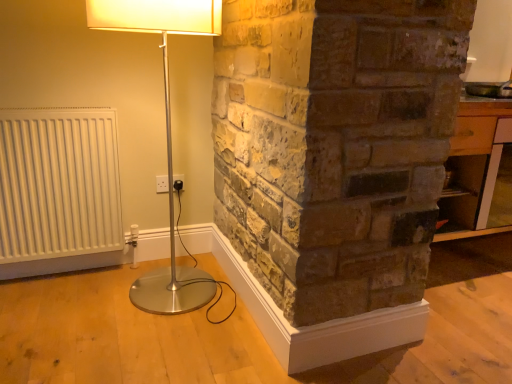
Question: From a real-world perspective, is white matte radiator at left beneath white plastic electric outlet at center?

Choices:
 (A) no
 (B) yes

Answer: (A)

Question: Is white matte radiator at left shorter than white plastic electric outlet at center?

Choices:
 (A) yes
 (B) no

Answer: (B)

Question: Does white matte radiator at left turn towards white plastic electric outlet at center?

Choices:
 (A) yes
 (B) no

Answer: (B)

Question: Is white matte radiator at left taller than white plastic electric outlet at center?

Choices:
 (A) no
 (B) yes

Answer: (B)

Question: Is white matte radiator at left looking in the opposite direction of white plastic electric outlet at center?

Choices:
 (A) no
 (B) yes

Answer: (A)

Question: Is white matte radiator at left outside white plastic electric outlet at center?

Choices:
 (A) no
 (B) yes

Answer: (B)

Question: Does white matte radiator at left appear on the left side of wooden table at right?

Choices:
 (A) yes
 (B) no

Answer: (A)

Question: Considering the relative sizes of white matte radiator at left and wooden table at right in the image provided, is white matte radiator at left shorter than wooden table at right?

Choices:
 (A) no
 (B) yes

Answer: (A)

Question: Does white matte radiator at left appear on the right side of wooden table at right?

Choices:
 (A) yes
 (B) no

Answer: (B)

Question: From the image's perspective, would you say white matte radiator at left is shown under wooden table at right?

Choices:
 (A) yes
 (B) no

Answer: (A)

Question: Does white matte radiator at left have a smaller size compared to wooden table at right?

Choices:
 (A) no
 (B) yes

Answer: (B)

Question: Does white matte radiator at left turn towards wooden table at right?

Choices:
 (A) yes
 (B) no

Answer: (B)

Question: From a real-world perspective, is white plastic electric outlet at center under wooden table at right?

Choices:
 (A) no
 (B) yes

Answer: (B)